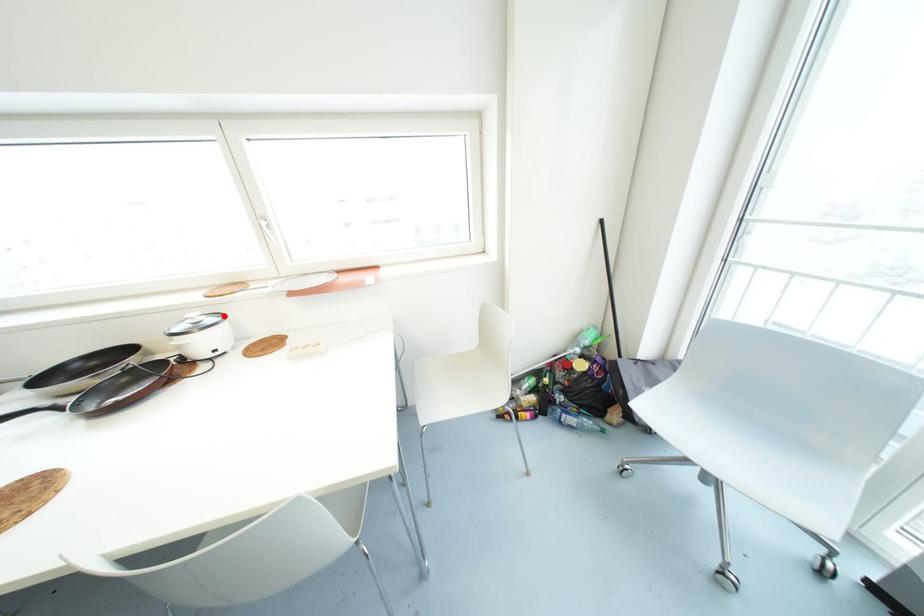
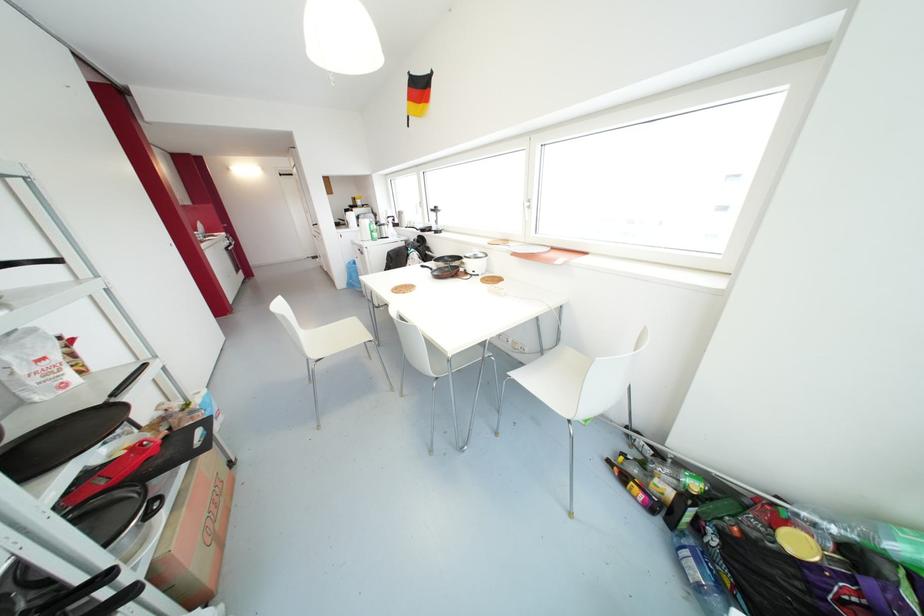
Where in the second image is the point corresponding to the highlighted location from the first image?

(485, 254)